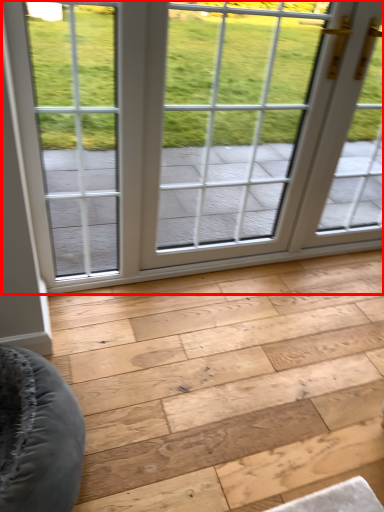
Question: Where is window (annotated by the red box) located in relation to plank in the image?

Choices:
 (A) right
 (B) left

Answer: (B)